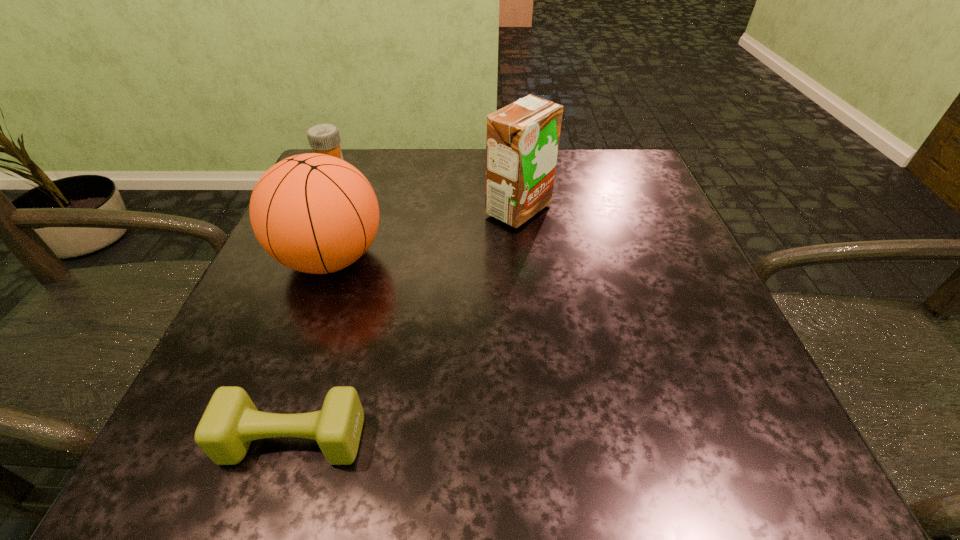
Image resolution: width=960 pixels, height=540 pixels. Find the location of `carton`. carton is located at coordinates (522, 139).

Where is `basketball`? Image resolution: width=960 pixels, height=540 pixels. basketball is located at coordinates (314, 213).

The width and height of the screenshot is (960, 540). I want to click on medicine, so coord(324,138).

What are the coordinates of `the third tallest object` in the screenshot? It's located at (324, 138).

Identify the location of the shortest object. This screenshot has height=540, width=960. (231, 421).

I want to click on the nearest object, so click(231, 421).

In order to click on vacant space located on the straw side of the rightmost object in this screenshot , I will do `click(408, 210)`.

Find the location of a particular element. Image resolution: width=960 pixels, height=540 pixels. free space located 0.360m on the straw side of the rightmost object is located at coordinates (312, 210).

Where is `free spot located 0.200m on the straw side of the rightmost object`? This screenshot has height=540, width=960. free spot located 0.200m on the straw side of the rightmost object is located at coordinates (389, 210).

Image resolution: width=960 pixels, height=540 pixels. I want to click on free spot located on the right of the basketball, so click(x=511, y=258).